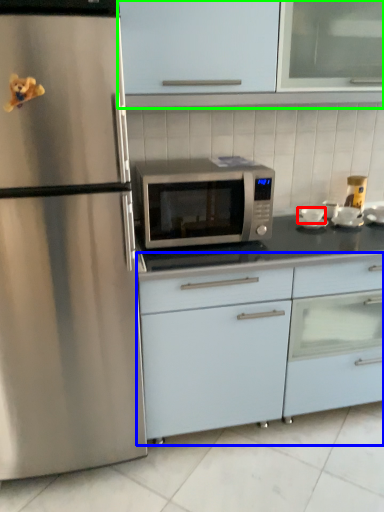
Question: Based on their relative distances, which object is farther from appliance (highlighted by a red box)? Choose from cabinetry (highlighted by a blue box) and cabinetry (highlighted by a green box).

Choices:
 (A) cabinetry
 (B) cabinetry

Answer: (B)